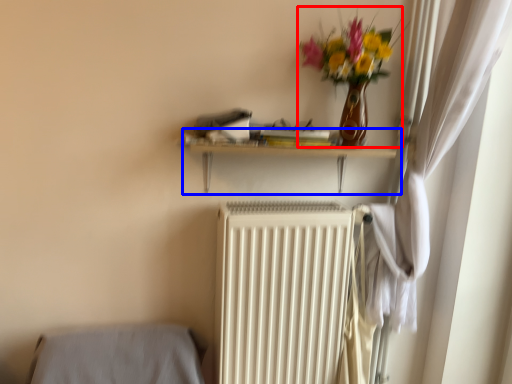
Question: Which of the following is the farthest to the observer, floral arrangement (highlighted by a red box) or shelf (highlighted by a blue box)?

Choices:
 (A) floral arrangement
 (B) shelf

Answer: (B)